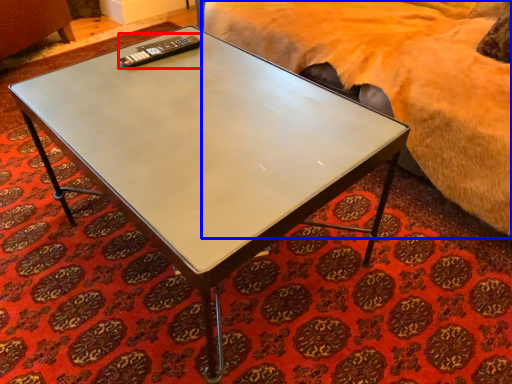
Question: Among these objects, which one is nearest to the camera, remote (highlighted by a red box) or bed (highlighted by a blue box)?

Choices:
 (A) remote
 (B) bed

Answer: (B)